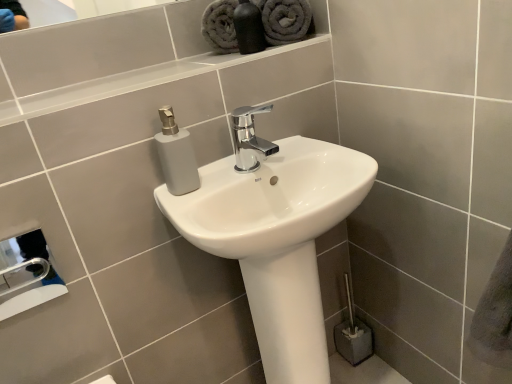
Image resolution: width=512 pixels, height=384 pixels. What are the coordinates of `metallic silver hand dryer at lower left` in the screenshot? It's located at (26, 274).

What is the approximate width of metallic silver hand dryer at lower left?

metallic silver hand dryer at lower left is 1.97 centimeters in width.

This screenshot has width=512, height=384. Describe the element at coordinates (249, 138) in the screenshot. I see `chrome metallic faucet at center` at that location.

What is the approximate height of matte black bottle at upper center?

matte black bottle at upper center is 26.32 centimeters in height.

How much space does gray plush towel at upper center, which is the 1th bath towel from left to right, occupy horizontally?

5.22 inches.

Locate an element on the screen. The width and height of the screenshot is (512, 384). metallic silver hand dryer at lower left is located at coordinates (26, 274).

Is chrome metallic faucet at center spatially inside metallic silver hand dryer at lower left, or outside of it?

chrome metallic faucet at center is outside metallic silver hand dryer at lower left.

From a real-world perspective, is chrome metallic faucet at center physically below metallic silver hand dryer at lower left?

Actually, chrome metallic faucet at center is physically above metallic silver hand dryer at lower left in the real world.

Based on the photo, from the image's perspective, which is above, chrome metallic faucet at center or metallic silver hand dryer at lower left?

chrome metallic faucet at center, from the image's perspective.

Which object is wider, matte black bottle at upper center or white glossy sink at center?

With larger width is white glossy sink at center.

Considering the relative positions of matte black bottle at upper center and white glossy sink at center in the image provided, is matte black bottle at upper center to the left of white glossy sink at center from the viewer's perspective?

Yes, matte black bottle at upper center is to the left of white glossy sink at center.

Can you confirm if matte black bottle at upper center is smaller than white glossy sink at center?

Indeed, matte black bottle at upper center has a smaller size compared to white glossy sink at center.

From the image's perspective, is matte black bottle at upper center positioned above or below white glossy sink at center?

Clearly, from the image's perspective, matte black bottle at upper center is above white glossy sink at center.

From the image's perspective, is gray plush towel at upper center, which is the 1th bath towel from left to right, located above or below chrome metallic faucet at center?

From the image's perspective, gray plush towel at upper center, which is the 1th bath towel from left to right, appears above chrome metallic faucet at center.

Is gray plush towel at upper center, which is the 1th bath towel from left to right, taller or shorter than chrome metallic faucet at center?

Clearly, gray plush towel at upper center, which is the 1th bath towel from left to right, is taller compared to chrome metallic faucet at center.

From a real-world perspective, relative to chrome metallic faucet at center, is gray plush towel at upper center, which is the 1th bath towel from left to right, vertically above or below?

In terms of real-world spatial position, gray plush towel at upper center, which is the 1th bath towel from left to right, is above chrome metallic faucet at center.

From a real-world perspective, between chrome metallic faucet at center and gray plush towel at upper center, which ranks as the second bath towel in left-to-right order, who is vertically higher?

gray plush towel at upper center, which ranks as the second bath towel in left-to-right order, is physically above.

From the image's perspective, is chrome metallic faucet at center located above or below gray plush towel at upper center, which ranks as the second bath towel in left-to-right order?

Based on their image positions, chrome metallic faucet at center is located beneath gray plush towel at upper center, which ranks as the second bath towel in left-to-right order.

Can we say chrome metallic faucet at center lies outside gray plush towel at upper center, which ranks as the second bath towel in left-to-right order?

Yes, chrome metallic faucet at center is not within gray plush towel at upper center, which ranks as the second bath towel in left-to-right order.

Looking at this image, can you tell me how much chrome metallic faucet at center and gray plush towel at upper center, marked as the first bath towel in a right-to-left arrangement, differ in facing direction?

39 degrees separate the facing orientations of chrome metallic faucet at center and gray plush towel at upper center, marked as the first bath towel in a right-to-left arrangement.

Is matte black bottle at upper center situated inside gray plush towel at upper center, the 2th bath towel positioned from the right, or outside?

matte black bottle at upper center is spatially situated outside gray plush towel at upper center, the 2th bath towel positioned from the right.

From the picture: Is matte black bottle at upper center touching gray plush towel at upper center, which is the 1th bath towel from left to right?

Yes, matte black bottle at upper center is right next to gray plush towel at upper center, which is the 1th bath towel from left to right, and making contact.

Is matte black bottle at upper center smaller than gray plush towel at upper center, the 2th bath towel positioned from the right?

Actually, matte black bottle at upper center might be larger than gray plush towel at upper center, the 2th bath towel positioned from the right.

The height and width of the screenshot is (384, 512). I want to click on the 2nd bath towel below when counting from the matte black bottle at upper center (from the image's perspective), so click(220, 26).

Who is shorter, metallic silver hand dryer at lower left or matte black bottle at upper center?

Standing shorter between the two is metallic silver hand dryer at lower left.

From a real-world perspective, does metallic silver hand dryer at lower left sit lower than matte black bottle at upper center?

Yes, from a real-world perspective, metallic silver hand dryer at lower left is under matte black bottle at upper center.

Would you say metallic silver hand dryer at lower left is outside matte black bottle at upper center?

Yes.

Locate an element on the screen. toiletry lying on the right of metallic silver hand dryer at lower left is located at coordinates (249, 28).

Between matte black bottle at upper center and gray plush towel at upper center, marked as the first bath towel in a right-to-left arrangement, which one has larger width?

gray plush towel at upper center, marked as the first bath towel in a right-to-left arrangement.

Is matte black bottle at upper center facing away from gray plush towel at upper center, marked as the first bath towel in a right-to-left arrangement?

No, matte black bottle at upper center is not facing the opposite direction of gray plush towel at upper center, marked as the first bath towel in a right-to-left arrangement.

Is point (241, 35) less distant than point (301, 1)?

No, (241, 35) is further to viewer.

Between matte black bottle at upper center and gray plush towel at upper center, which ranks as the second bath towel in left-to-right order, which one appears on the right side from the viewer's perspective?

gray plush towel at upper center, which ranks as the second bath towel in left-to-right order, is more to the right.

This screenshot has height=384, width=512. Find the location of `tap lying behind the metallic silver hand dryer at lower left`. tap lying behind the metallic silver hand dryer at lower left is located at coordinates (249, 138).

Find the location of a particular element. This screenshot has height=384, width=512. sink in front of the matte black bottle at upper center is located at coordinates tap(275, 233).

Estimate the real-world distances between objects in this image. Which object is closer to metallic silver hand dryer at lower left, gray plush towel at upper center, which ranks as the second bath towel in left-to-right order, or chrome metallic faucet at center?

Among the two, chrome metallic faucet at center is located nearer to metallic silver hand dryer at lower left.

Considering their positions, is gray plush towel at upper center, which is the 1th bath towel from left to right, positioned further to matte black bottle at upper center than white glossy sink at center?

white glossy sink at center is positioned further to the anchor matte black bottle at upper center.

From the image, which object appears to be nearer to matte black bottle at upper center, gray plush towel at upper center, marked as the first bath towel in a right-to-left arrangement, or chrome metallic faucet at center?

Based on the image, gray plush towel at upper center, marked as the first bath towel in a right-to-left arrangement, appears to be nearer to matte black bottle at upper center.

Based on their spatial positions, is metallic silver hand dryer at lower left or white glossy sink at center further from chrome metallic faucet at center?

The object further to chrome metallic faucet at center is metallic silver hand dryer at lower left.

Looking at the image, which one is located closer to gray plush towel at upper center, the 2th bath towel positioned from the right, matte black bottle at upper center or metallic silver hand dryer at lower left?

matte black bottle at upper center.

In the scene shown: Looking at the image, which one is located further to gray plush towel at upper center, which is the 1th bath towel from left to right, white glossy sink at center or chrome metallic faucet at center?

Among the two, white glossy sink at center is located further to gray plush towel at upper center, which is the 1th bath towel from left to right.

When comparing their distances from white glossy sink at center, does matte black bottle at upper center or gray plush towel at upper center, which ranks as the second bath towel in left-to-right order, seem closer?

Among the two, matte black bottle at upper center is located nearer to white glossy sink at center.

From the image, which object appears to be nearer to gray plush towel at upper center, marked as the first bath towel in a right-to-left arrangement, metallic silver hand dryer at lower left or matte black bottle at upper center?

The object closer to gray plush towel at upper center, marked as the first bath towel in a right-to-left arrangement, is matte black bottle at upper center.

Locate an element on the screen. Image resolution: width=512 pixels, height=384 pixels. hand dryer between gray plush towel at upper center, which is the 1th bath towel from left to right, and white glossy sink at center from top to bottom is located at coordinates (26, 274).

At what (x,y) coordinates should I click in order to perform the action: click on bath towel between gray plush towel at upper center, which ranks as the second bath towel in left-to-right order, and white glossy sink at center in the up-down direction. Please return your answer as a coordinate pair (x, y). Looking at the image, I should click on (220, 26).

Locate an element on the screen. tap that lies between matte black bottle at upper center and metallic silver hand dryer at lower left from top to bottom is located at coordinates click(249, 138).

The width and height of the screenshot is (512, 384). Identify the location of tap that lies between matte black bottle at upper center and white glossy sink at center from top to bottom. (249, 138).